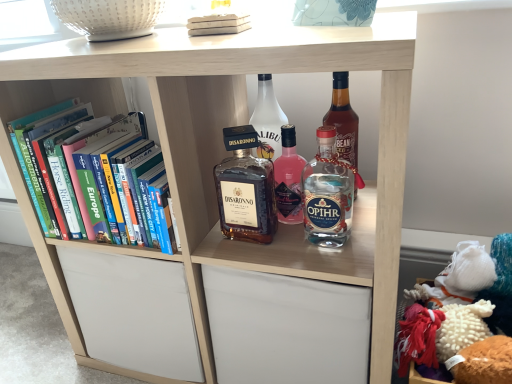
Question: Is clear glass bottle at center, the third bottle when ordered from left to right, completely or partially outside of white matte book at upper center, the first book positioned from the front?

Choices:
 (A) no
 (B) yes

Answer: (B)

Question: Is clear glass bottle at center, the third bottle when ordered from left to right, looking in the opposite direction of white matte book at upper center, the 2th book in the bottom-to-top sequence?

Choices:
 (A) no
 (B) yes

Answer: (A)

Question: Are clear glass bottle at center, the third bottle when ordered from left to right, and white matte book at upper center, the second book positioned from the back, far apart?

Choices:
 (A) yes
 (B) no

Answer: (B)

Question: Is clear glass bottle at center, which is the 1th bottle in right-to-left order, to the right of white matte book at upper center, positioned as the 1th book in right-to-left order, from the viewer's perspective?

Choices:
 (A) yes
 (B) no

Answer: (A)

Question: Is clear glass bottle at center, the third bottle when ordered from left to right, further to the viewer compared to white matte book at upper center, the 2th book in the bottom-to-top sequence?

Choices:
 (A) yes
 (B) no

Answer: (B)

Question: Is clear glass bottle at center, the third bottle when ordered from left to right, to the left of white matte book at upper center, the second book viewed from the left, from the viewer's perspective?

Choices:
 (A) no
 (B) yes

Answer: (A)

Question: Does white matte book at upper center, positioned as the 1th book in right-to-left order, have a lesser height compared to matte glass bottle at center, which is the third bottle in right-to-left order?

Choices:
 (A) no
 (B) yes

Answer: (B)

Question: Considering the relative sizes of white matte book at upper center, the second book viewed from the left, and matte glass bottle at center, which is the third bottle in right-to-left order, in the image provided, is white matte book at upper center, the second book viewed from the left, bigger than matte glass bottle at center, which is the third bottle in right-to-left order,?

Choices:
 (A) yes
 (B) no

Answer: (A)

Question: Would you say white matte book at upper center, marked as the first book in a top-to-bottom arrangement, contains matte glass bottle at center, arranged as the first bottle when viewed from the left?

Choices:
 (A) yes
 (B) no

Answer: (B)

Question: From a real-world perspective, is white matte book at upper center, marked as the first book in a top-to-bottom arrangement, physically below matte glass bottle at center, arranged as the first bottle when viewed from the left?

Choices:
 (A) no
 (B) yes

Answer: (A)

Question: Does white matte book at upper center, the 2th book in the bottom-to-top sequence, appear on the left side of matte glass bottle at center, which is the third bottle in right-to-left order?

Choices:
 (A) no
 (B) yes

Answer: (B)

Question: Considering the relative sizes of white matte book at upper center, the first book positioned from the front, and matte glass bottle at center, arranged as the first bottle when viewed from the left, in the image provided, is white matte book at upper center, the first book positioned from the front, wider than matte glass bottle at center, arranged as the first bottle when viewed from the left,?

Choices:
 (A) yes
 (B) no

Answer: (A)

Question: Can hardcover books at left, positioned as the first book in left-to-right order, be found inside clear glass bottle at center, which is the 1th bottle in right-to-left order?

Choices:
 (A) yes
 (B) no

Answer: (B)